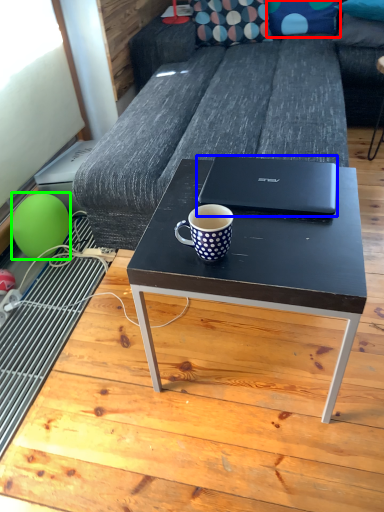
Question: Based on their relative distances, which object is nearer to pillow (highlighted by a red box)? Choose from laptop (highlighted by a blue box) and balloon (highlighted by a green box).

Choices:
 (A) laptop
 (B) balloon

Answer: (A)